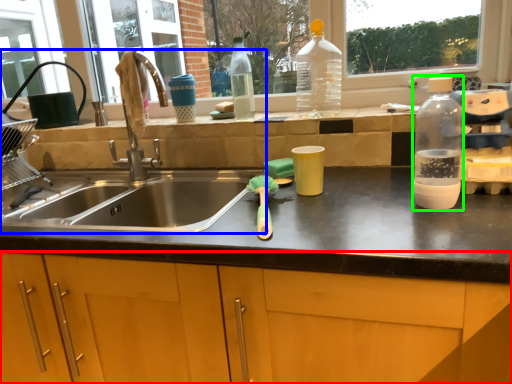
Question: Considering the real-world distances, which object is farthest from cabinetry (highlighted by a red box)? sink (highlighted by a blue box) or bottle (highlighted by a green box)?

Choices:
 (A) sink
 (B) bottle

Answer: (B)